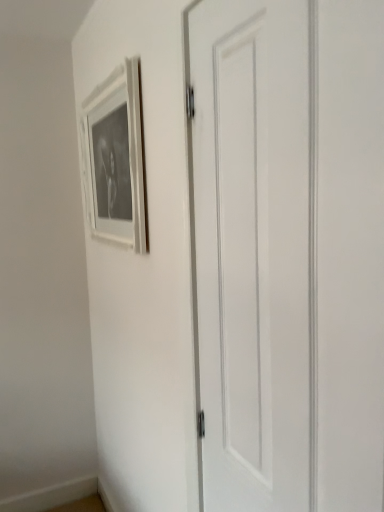
Question: Is white matte picture frame at upper left surrounding white matte door at center?

Choices:
 (A) yes
 (B) no

Answer: (B)

Question: Is white matte picture frame at upper left positioned before white matte door at center?

Choices:
 (A) yes
 (B) no

Answer: (B)

Question: Is white matte picture frame at upper left oriented away from white matte door at center?

Choices:
 (A) no
 (B) yes

Answer: (A)

Question: From the image's perspective, would you say white matte picture frame at upper left is shown under white matte door at center?

Choices:
 (A) yes
 (B) no

Answer: (B)

Question: Can you confirm if white matte picture frame at upper left is wider than white matte door at center?

Choices:
 (A) no
 (B) yes

Answer: (B)

Question: From the image's perspective, is white matte picture frame at upper left over white matte door at center?

Choices:
 (A) yes
 (B) no

Answer: (A)

Question: Is white matte door at center looking in the opposite direction of white matte picture frame at upper left?

Choices:
 (A) yes
 (B) no

Answer: (B)

Question: Does white matte door at center appear on the left side of white matte picture frame at upper left?

Choices:
 (A) no
 (B) yes

Answer: (A)

Question: Can you confirm if white matte door at center is bigger than white matte picture frame at upper left?

Choices:
 (A) no
 (B) yes

Answer: (B)

Question: Is white matte door at center in front of white matte picture frame at upper left?

Choices:
 (A) yes
 (B) no

Answer: (A)

Question: From a real-world perspective, is white matte door at center physically above white matte picture frame at upper left?

Choices:
 (A) yes
 (B) no

Answer: (B)

Question: Can you confirm if white matte door at center is thinner than white matte picture frame at upper left?

Choices:
 (A) no
 (B) yes

Answer: (B)

Question: Is white matte picture frame at upper left wider or thinner than white matte door at center?

Choices:
 (A) thin
 (B) wide

Answer: (B)